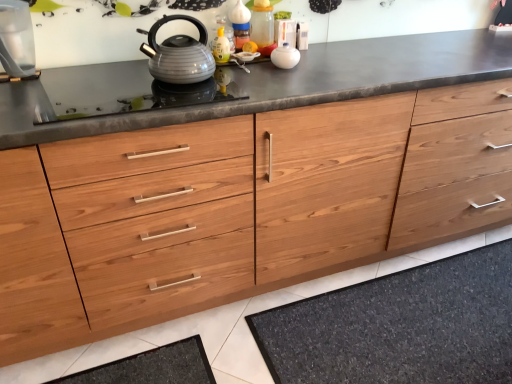
The image size is (512, 384). Identify the location of vacant space underneath dark gray textured bath mat at lower center (from a real-world perspective). (434, 334).